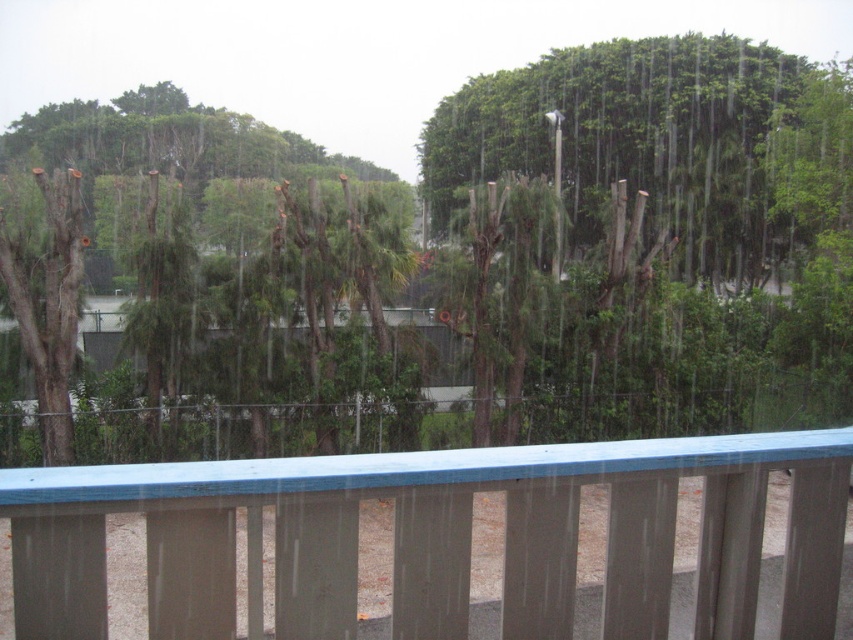
Question: Which point is farther to the camera?

Choices:
 (A) blue painted wood at center
 (B) green matte tree at center

Answer: (B)

Question: Does green matte tree at center appear over blue painted wood at center?

Choices:
 (A) no
 (B) yes

Answer: (B)

Question: Which object is farther from the camera taking this photo?

Choices:
 (A) green matte tree at center
 (B) blue painted wood at center

Answer: (A)

Question: Is green matte tree at center positioned before blue painted wood at center?

Choices:
 (A) yes
 (B) no

Answer: (B)

Question: Which point is farther to the camera?

Choices:
 (A) green matte tree at center
 (B) blue painted wood at center

Answer: (A)

Question: Can you confirm if green matte tree at center is wider than blue painted wood at center?

Choices:
 (A) no
 (B) yes

Answer: (B)